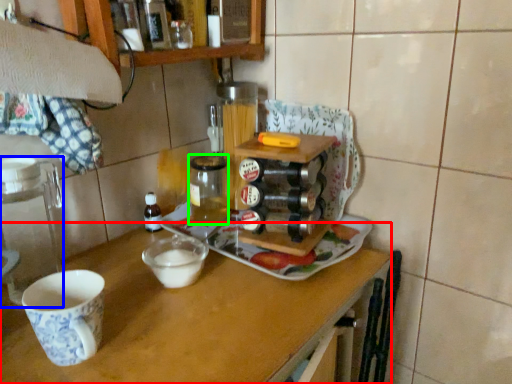
Question: Which object is the closest to the table (highlighted by a red box)? Choose among these: appliance (highlighted by a blue box) or beverage (highlighted by a green box).

Choices:
 (A) appliance
 (B) beverage

Answer: (A)